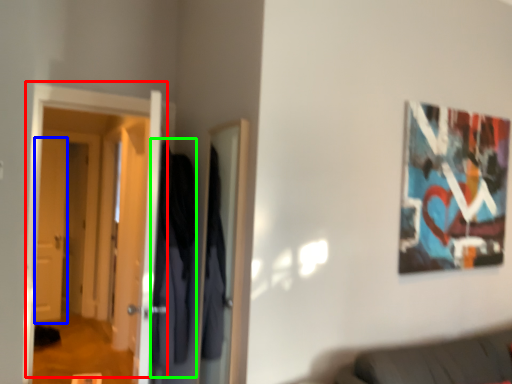
Question: Which is farther away from door (highlighted by a red box)? door (highlighted by a blue box) or robe (highlighted by a green box)?

Choices:
 (A) door
 (B) robe

Answer: (A)